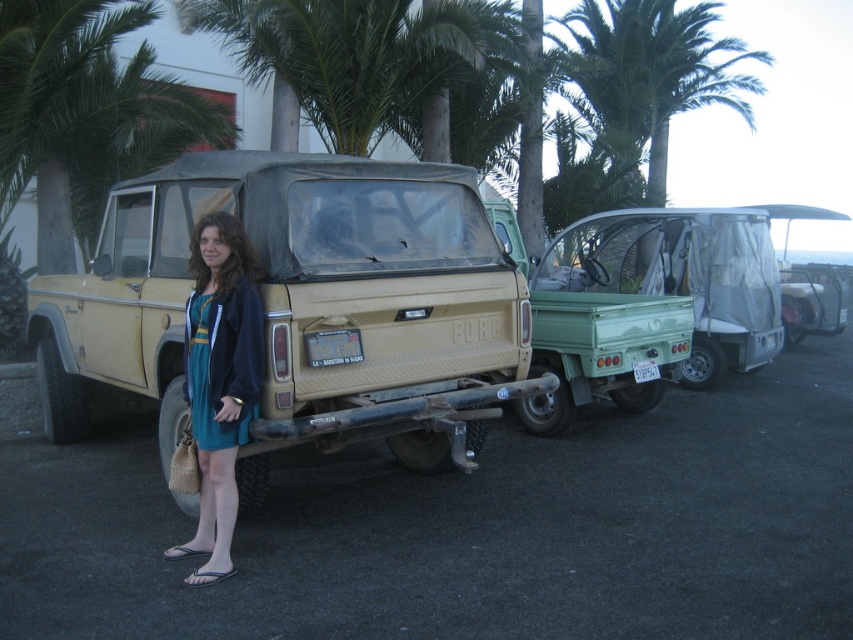
Question: Considering the real-world distances, which object is farthest from the teal satin dress at lower left?

Choices:
 (A) matte yellow jeep at center
 (B) metallic silver license plate at center
 (C) green matte pickup truck at right

Answer: (C)

Question: Among these points, which one is farthest from the camera?

Choices:
 (A) (358, 340)
 (B) (631, 371)
 (C) (587, 10)

Answer: (C)

Question: Considering the relative positions of teal satin dress at lower left and white plastic license plate at rear in the image provided, where is teal satin dress at lower left located with respect to white plastic license plate at rear?

Choices:
 (A) above
 (B) below

Answer: (A)

Question: Observing the image, what is the correct spatial positioning of green matte pickup truck at right in reference to green leafy palm tree at upper center?

Choices:
 (A) above
 (B) below

Answer: (B)

Question: Considering the relative positions of green leafy palm tree at upper center and white plastic license plate at rear in the image provided, where is green leafy palm tree at upper center located with respect to white plastic license plate at rear?

Choices:
 (A) below
 (B) above

Answer: (B)

Question: Which point is closer to the camera taking this photo?

Choices:
 (A) (676, 109)
 (B) (354, 355)

Answer: (B)